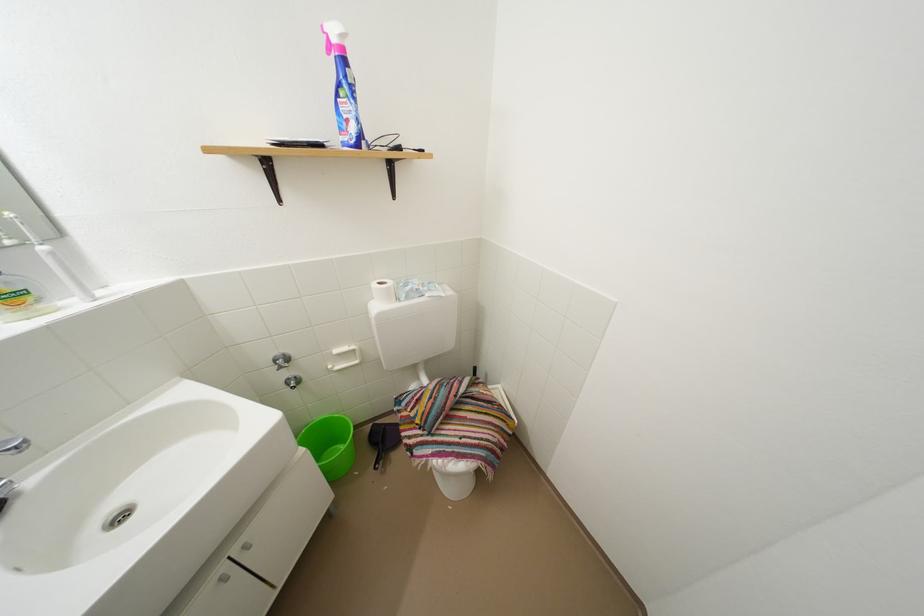
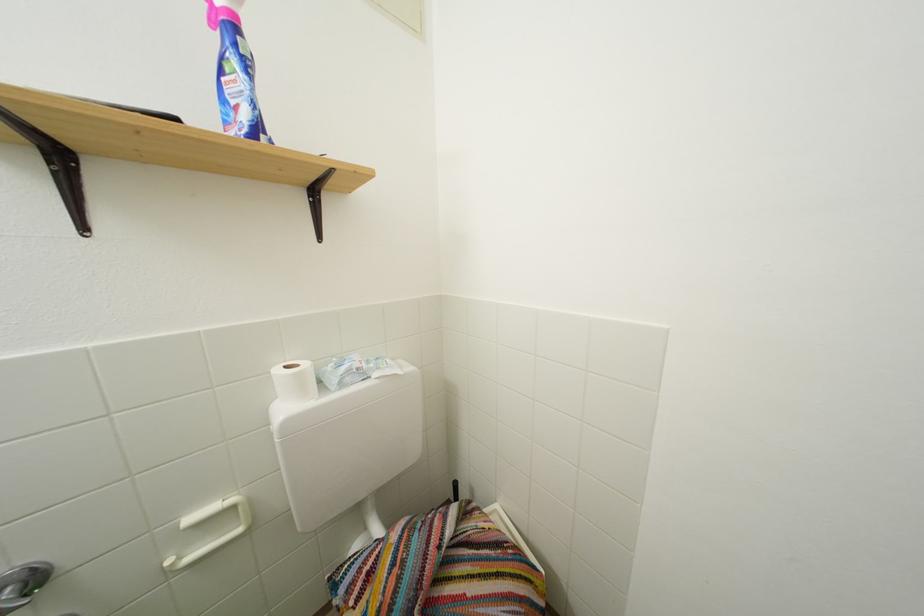
Question: What movement of the cameraman would produce the second image?

Choices:
 (A) Left
 (B) Right
 (C) Forward
 (D) Backward

Answer: (C)